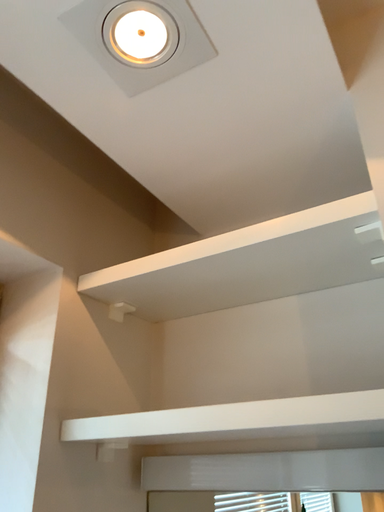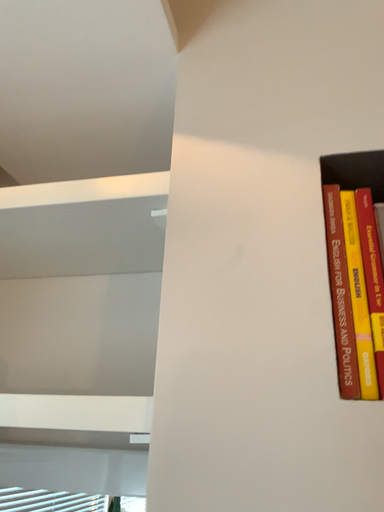
Question: Which way did the camera rotate in the video?

Choices:
 (A) rotated left
 (B) rotated right

Answer: (B)